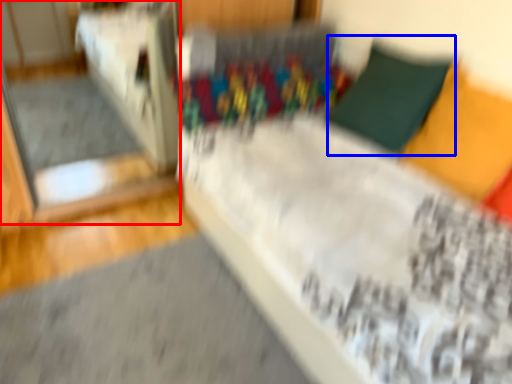
Question: Which object appears farthest to the camera in this image, glass door (highlighted by a red box) or pillow (highlighted by a blue box)?

Choices:
 (A) glass door
 (B) pillow

Answer: (A)